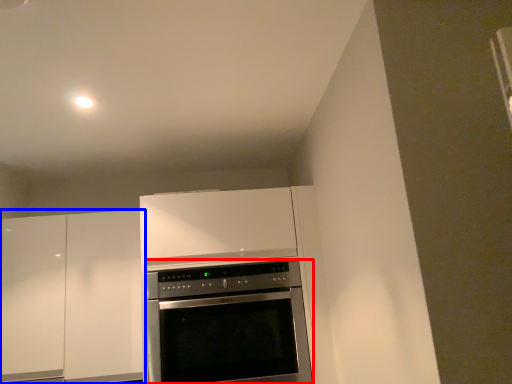
Question: Which object appears farthest to the camera in this image, oven (highlighted by a red box) or cabinetry (highlighted by a blue box)?

Choices:
 (A) oven
 (B) cabinetry

Answer: (B)